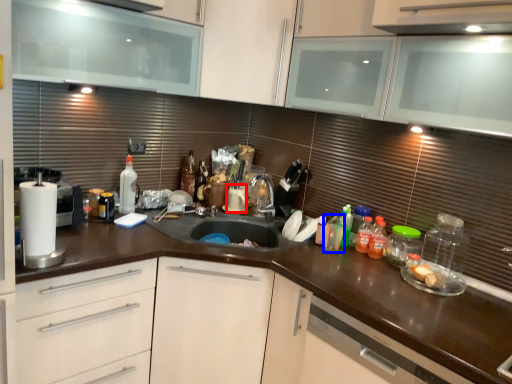
Question: Which object appears closest to the camera in this image, appliance (highlighted by a red box) or bottle (highlighted by a blue box)?

Choices:
 (A) appliance
 (B) bottle

Answer: (B)